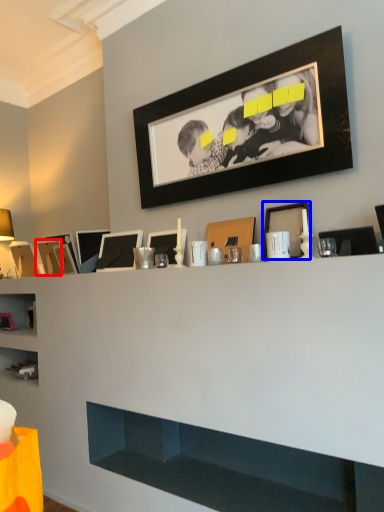
Question: Which point is further to the camera, picture frame (highlighted by a red box) or picture frame (highlighted by a blue box)?

Choices:
 (A) picture frame
 (B) picture frame

Answer: (A)